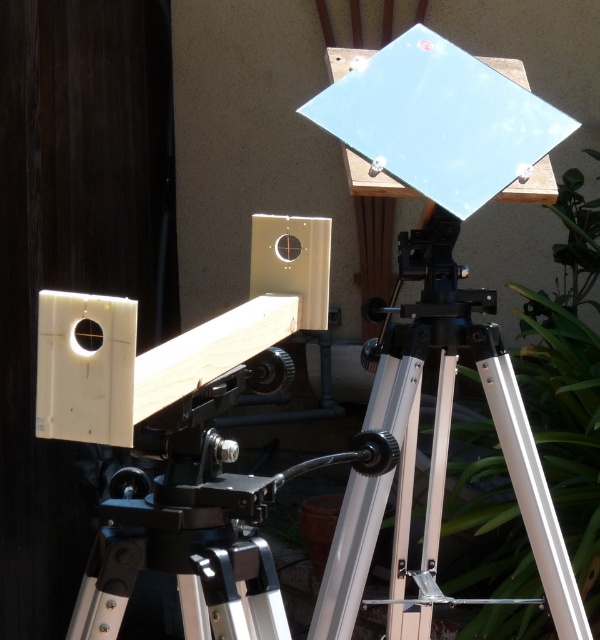
Question: Which of the following is the farthest from the observer?

Choices:
 (A) (384, 440)
 (B) (390, 416)

Answer: (B)

Question: Observing the image, what is the correct spatial positioning of silver metallic tripod at center in reference to matte black lens at center?

Choices:
 (A) below
 (B) above

Answer: (A)

Question: Can you confirm if silver metallic tripod at center is positioned to the left of matte black lens at center?

Choices:
 (A) no
 (B) yes

Answer: (A)

Question: Is silver metallic tripod at center closer to camera compared to matte black lens at center?

Choices:
 (A) no
 (B) yes

Answer: (A)

Question: Among these points, which one is farthest from the camera?

Choices:
 (A) (430, 628)
 (B) (379, 467)

Answer: (A)